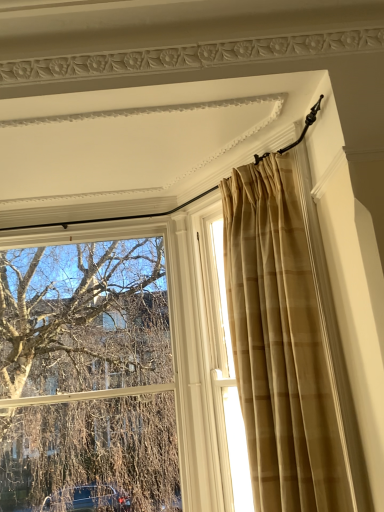
This screenshot has width=384, height=512. Describe the element at coordinates (224, 355) in the screenshot. I see `beige textured curtain at right, the 2th window viewed from the left` at that location.

Find the location of a particular element. beige textured curtain at right, which is counted as the first window, starting from the right is located at coordinates (224, 355).

Is beige plaid curtain at upper right at the left side of clear glass window at upper left, placed as the first window when sorted from left to right?

No, beige plaid curtain at upper right is not to the left of clear glass window at upper left, placed as the first window when sorted from left to right.

Is beige plaid curtain at upper right oriented away from clear glass window at upper left, placed as the first window when sorted from left to right?

No.

Looking at the image, does beige plaid curtain at upper right seem bigger or smaller compared to clear glass window at upper left, the second window when ordered from right to left?

beige plaid curtain at upper right is bigger than clear glass window at upper left, the second window when ordered from right to left.

Could you measure the distance between beige plaid curtain at upper right and beige textured curtain at right, which is counted as the first window, starting from the right?

beige plaid curtain at upper right is 22.02 inches from beige textured curtain at right, which is counted as the first window, starting from the right.

Which is correct: beige plaid curtain at upper right is inside beige textured curtain at right, the 2th window viewed from the left, or outside of it?

beige plaid curtain at upper right cannot be found inside beige textured curtain at right, the 2th window viewed from the left.

In the scene shown: Does beige plaid curtain at upper right have a greater width compared to beige textured curtain at right, the 2th window viewed from the left?

Yes.

Are beige plaid curtain at upper right and beige textured curtain at right, the 2th window viewed from the left, located far from each other?

No, beige plaid curtain at upper right is not far from beige textured curtain at right, the 2th window viewed from the left.

Is clear glass window at upper left, the second window when ordered from right to left, oriented towards beige plaid curtain at upper right?

No, clear glass window at upper left, the second window when ordered from right to left, is not facing towards beige plaid curtain at upper right.

Is clear glass window at upper left, placed as the first window when sorted from left to right, inside or outside of beige plaid curtain at upper right?

clear glass window at upper left, placed as the first window when sorted from left to right, is spatially situated outside beige plaid curtain at upper right.

Does clear glass window at upper left, placed as the first window when sorted from left to right, have a greater height compared to beige plaid curtain at upper right?

Correct, clear glass window at upper left, placed as the first window when sorted from left to right, is much taller as beige plaid curtain at upper right.

Does clear glass window at upper left, the second window when ordered from right to left, have a lesser width compared to beige plaid curtain at upper right?

Indeed, clear glass window at upper left, the second window when ordered from right to left, has a lesser width compared to beige plaid curtain at upper right.

Could you tell me if beige textured curtain at right, the 2th window viewed from the left, is facing clear glass window at upper left, the second window when ordered from right to left?

No, beige textured curtain at right, the 2th window viewed from the left, is not oriented towards clear glass window at upper left, the second window when ordered from right to left.

Considering the relative sizes of beige textured curtain at right, the 2th window viewed from the left, and clear glass window at upper left, the second window when ordered from right to left, in the image provided, is beige textured curtain at right, the 2th window viewed from the left, shorter than clear glass window at upper left, the second window when ordered from right to left,?

Yes, beige textured curtain at right, the 2th window viewed from the left, is shorter than clear glass window at upper left, the second window when ordered from right to left.

From a real-world perspective, between beige textured curtain at right, which is counted as the first window, starting from the right, and clear glass window at upper left, the second window when ordered from right to left, who is vertically lower?

From a 3D spatial view, clear glass window at upper left, the second window when ordered from right to left, is below.

Is beige textured curtain at right, the 2th window viewed from the left, inside the boundaries of clear glass window at upper left, placed as the first window when sorted from left to right, or outside?

beige textured curtain at right, the 2th window viewed from the left, is located beyond the bounds of clear glass window at upper left, placed as the first window when sorted from left to right.

From the image's perspective, which object appears higher, beige textured curtain at right, which is counted as the first window, starting from the right, or beige plaid curtain at upper right?

From the image's view, beige plaid curtain at upper right is above.

Is point (216, 352) positioned before point (255, 168)?

That is False.

Can you confirm if beige textured curtain at right, which is counted as the first window, starting from the right, is smaller than beige plaid curtain at upper right?

Yes.

Choose the correct answer: Is beige textured curtain at right, the 2th window viewed from the left, inside beige plaid curtain at upper right or outside it?

beige textured curtain at right, the 2th window viewed from the left, is not enclosed by beige plaid curtain at upper right.

Does clear glass window at upper left, the second window when ordered from right to left, appear on the left side of beige textured curtain at right, which is counted as the first window, starting from the right?

Yes, clear glass window at upper left, the second window when ordered from right to left, is to the left of beige textured curtain at right, which is counted as the first window, starting from the right.

Is clear glass window at upper left, placed as the first window when sorted from left to right, not close to beige textured curtain at right, which is counted as the first window, starting from the right?

Yes, clear glass window at upper left, placed as the first window when sorted from left to right, is far from beige textured curtain at right, which is counted as the first window, starting from the right.

From the picture: Does clear glass window at upper left, the second window when ordered from right to left, have a larger size compared to beige textured curtain at right, which is counted as the first window, starting from the right?

Correct, clear glass window at upper left, the second window when ordered from right to left, is larger in size than beige textured curtain at right, which is counted as the first window, starting from the right.

Is clear glass window at upper left, placed as the first window when sorted from left to right, positioned with its back to beige textured curtain at right, the 2th window viewed from the left?

No.

At what (x,y) coordinates should I click in order to perform the action: click on curtain in front of the clear glass window at upper left, the second window when ordered from right to left. Please return your answer as a coordinate pair (x, y). The image size is (384, 512). Looking at the image, I should click on [279, 344].

From a real-world perspective, count 1st windows downward from the beige plaid curtain at upper right and point to it. Please provide its 2D coordinates.

[(224, 355)]

Based on the photo, which object lies nearer to the anchor point beige textured curtain at right, which is counted as the first window, starting from the right, beige plaid curtain at upper right or clear glass window at upper left, placed as the first window when sorted from left to right?

beige plaid curtain at upper right lies closer to beige textured curtain at right, which is counted as the first window, starting from the right, than the other object.

From the image, which object appears to be farther from beige plaid curtain at upper right, beige textured curtain at right, which is counted as the first window, starting from the right, or clear glass window at upper left, the second window when ordered from right to left?

clear glass window at upper left, the second window when ordered from right to left, is positioned further to the anchor beige plaid curtain at upper right.

Estimate the real-world distances between objects in this image. Which object is closer to clear glass window at upper left, placed as the first window when sorted from left to right, beige textured curtain at right, the 2th window viewed from the left, or beige plaid curtain at upper right?

beige textured curtain at right, the 2th window viewed from the left.

Estimate the real-world distances between objects in this image. Which object is further from beige plaid curtain at upper right, clear glass window at upper left, placed as the first window when sorted from left to right, or beige textured curtain at right, which is counted as the first window, starting from the right?

The object further to beige plaid curtain at upper right is clear glass window at upper left, placed as the first window when sorted from left to right.

When comparing their distances from clear glass window at upper left, the second window when ordered from right to left, does beige plaid curtain at upper right or beige textured curtain at right, the 2th window viewed from the left, seem closer?

beige textured curtain at right, the 2th window viewed from the left.

Which object lies nearer to the anchor point beige textured curtain at right, the 2th window viewed from the left, clear glass window at upper left, the second window when ordered from right to left, or beige plaid curtain at upper right?

Among the two, beige plaid curtain at upper right is located nearer to beige textured curtain at right, the 2th window viewed from the left.

You are a GUI agent. You are given a task and a screenshot of the screen. Output one action in this format:
    pyautogui.click(x=<x>, y=<y>)
    Task: Click on the window between beige plaid curtain at upper right and clear glass window at upper left, placed as the first window when sorted from left to right, in the front-back direction
    The width and height of the screenshot is (384, 512).
    Given the screenshot: What is the action you would take?
    pyautogui.click(x=224, y=355)